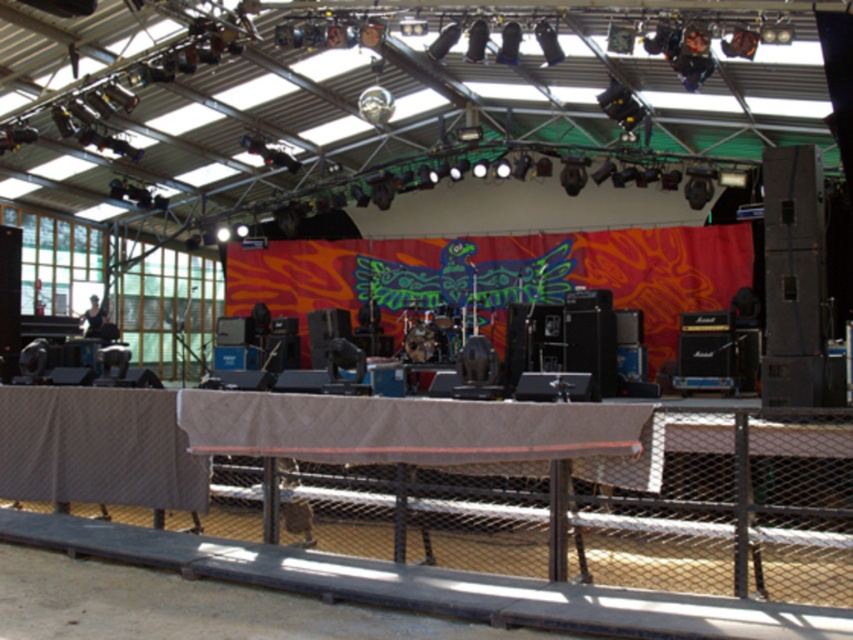
This screenshot has width=853, height=640. Find the location of `beige fabric-covered table at center`. beige fabric-covered table at center is located at coordinates (434, 435).

Is beige fabric-covered table at center to the left of brown textured table at lower left from the viewer's perspective?

Incorrect, beige fabric-covered table at center is not on the left side of brown textured table at lower left.

Does point (274, 448) come farther from viewer compared to point (45, 433)?

No, (274, 448) is closer to viewer.

Locate an element on the screen. This screenshot has height=640, width=853. beige fabric-covered table at center is located at coordinates (434, 435).